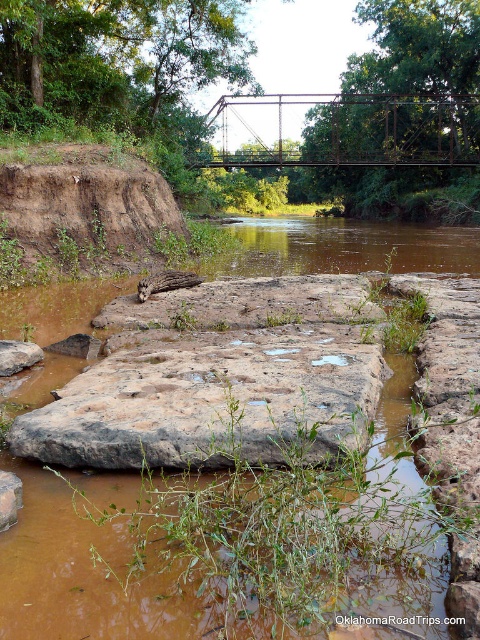
Can you confirm if brown muddy water at center is wider than rusty metal bridge at upper center?

Incorrect, brown muddy water at center's width does not surpass rusty metal bridge at upper center's.

In the scene shown: Which is below, brown muddy water at center or rusty metal bridge at upper center?

brown muddy water at center is lower down.

Does point (87, 612) lie in front of point (452, 109)?

Yes, point (87, 612) is in front of point (452, 109).

You are a GUI agent. You are given a task and a screenshot of the screen. Output one action in this format:
    pyautogui.click(x=<x>, y=<y>)
    Task: Click on the brown muddy water at center
    
    Given the screenshot: What is the action you would take?
    pyautogui.click(x=72, y=573)

Is point (109, 380) positioned in front of point (1, 356)?

Yes, point (109, 380) is closer to viewer.

Does brown rough rock at center have a lesser width compared to brown rough rock at lower left?

In fact, brown rough rock at center might be wider than brown rough rock at lower left.

What do you see at coordinates (211, 404) in the screenshot? This screenshot has height=640, width=480. I see `brown rough rock at center` at bounding box center [211, 404].

The height and width of the screenshot is (640, 480). In order to click on brown rough rock at center in this screenshot , I will do [211, 404].

Measure the distance between brown muddy water at center and brown rough rock at lower left.

6.66 meters

Can you confirm if brown muddy water at center is positioned to the left of brown rough rock at lower left?

No, brown muddy water at center is not to the left of brown rough rock at lower left.

The image size is (480, 640). Describe the element at coordinates (72, 573) in the screenshot. I see `brown muddy water at center` at that location.

Where is `brown muddy water at center`? The image size is (480, 640). brown muddy water at center is located at coordinates (72, 573).